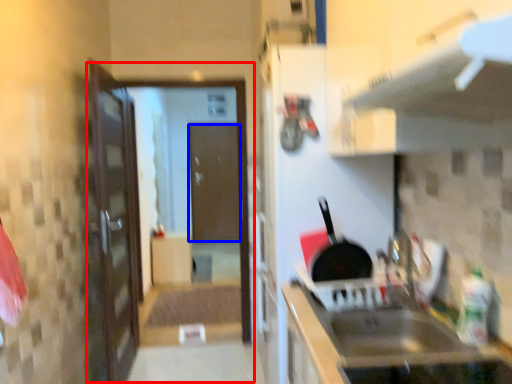
Question: Which of the following is the farthest to the observer, screen door (highlighted by a red box) or door (highlighted by a blue box)?

Choices:
 (A) screen door
 (B) door

Answer: (B)